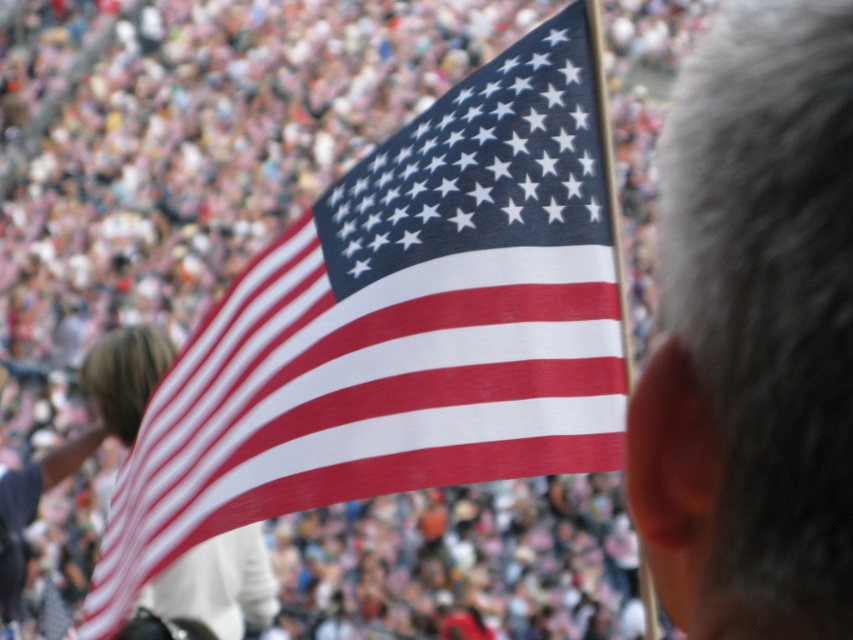
You are a photographer adjusting your camera settings to focus on the matte fabric flag at center and the gray hair at upper right. Which object should you focus on first to ensure both are in sharp focus?

You should focus on the matte fabric flag at center first because it is closer to you than the gray hair at upper right. By focusing on the closer object, the depth of field may also keep the gray hair at upper right in focus.

You are a photographer at the event and want to ensure that both the matte fabric flag at center and the gray hair at upper right are clearly visible in your photo. Based on their positions, which object should you adjust your focus to prioritize first?

The matte fabric flag at center is below gray hair at upper right, so you should prioritize focusing on the matte fabric flag at center first because it is closer to the camera. This ensures that the flag remains sharp while the gray hair at upper right may still be in acceptable focus depending on the depth of field.